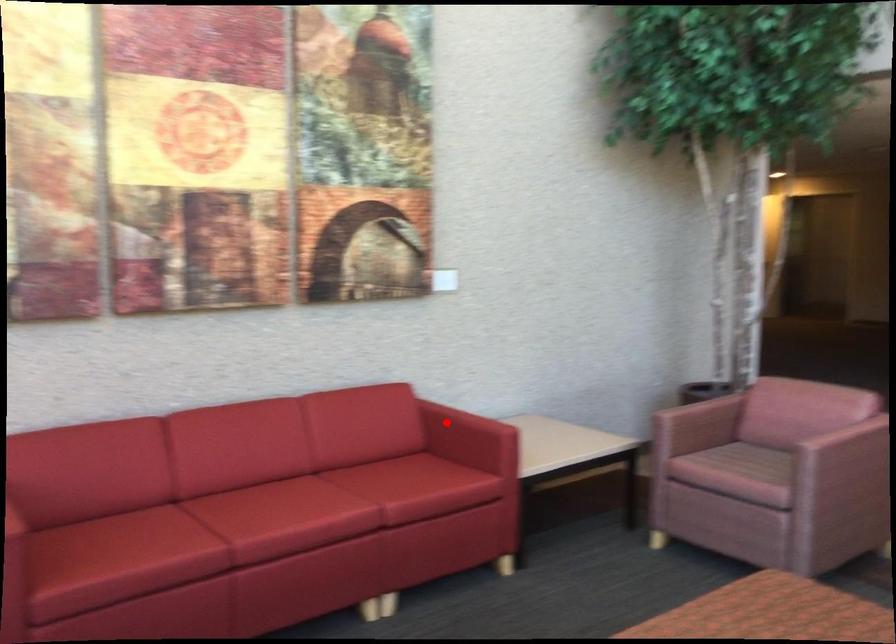
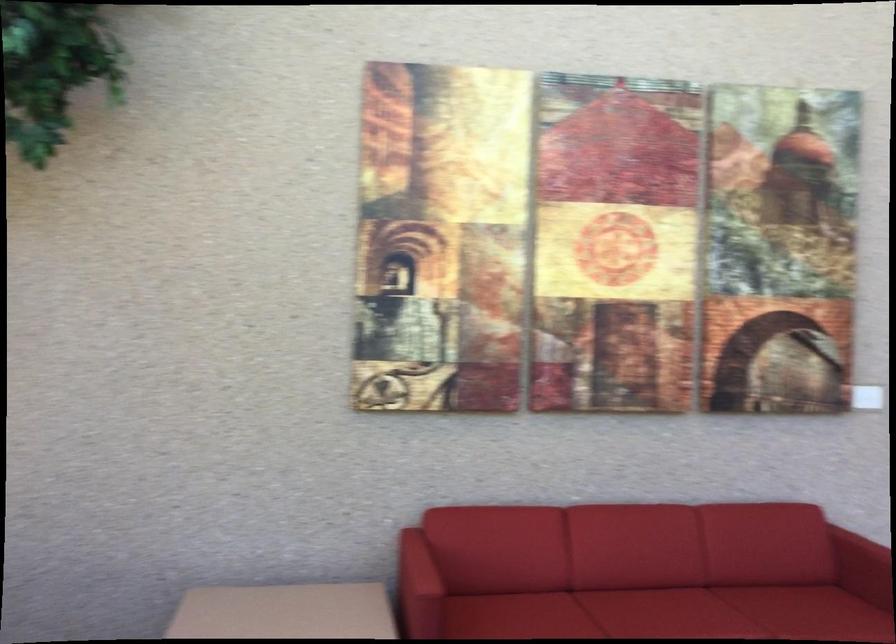
Question: A red point is marked in image1. In image2, is the corresponding 3D point closer to the camera or farther? Reply with the corresponding letter.

Choices:
 (A) The corresponding 3D point is closer.
 (B) The corresponding 3D point is farther.

Answer: (A)